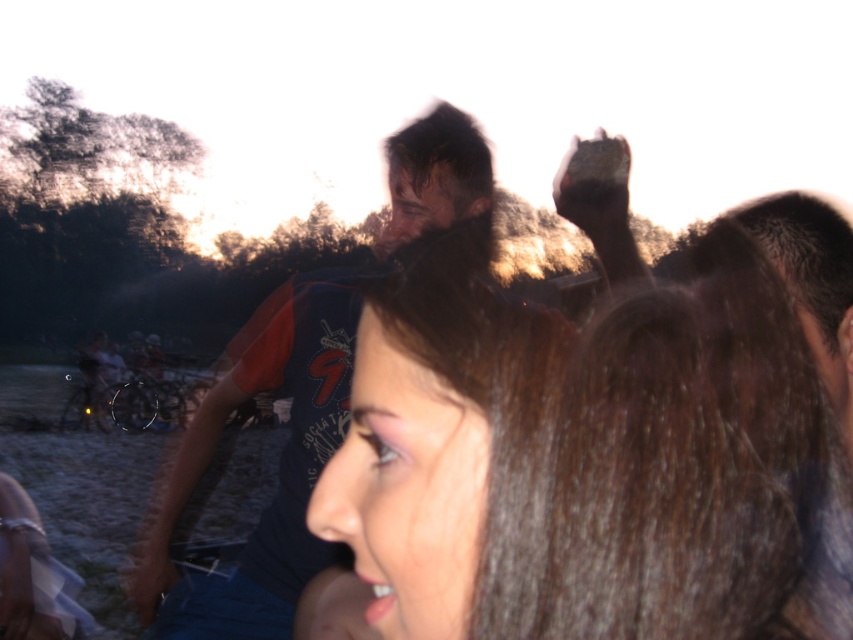
You are a photographer reviewing the image and want to ensure the brown hair at center is properly framed. Based on its position at coordinates, is it closer to the left or right side of the image?

The brown hair at center is located at coordinates point (583,458), which places it closer to the right side of the image.